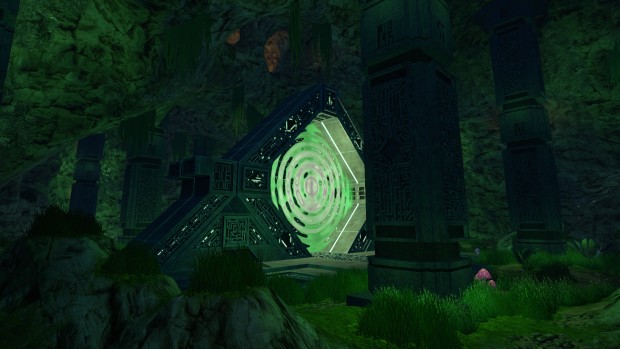
Identify the location of column. This screenshot has width=620, height=349. (514, 74), (401, 99).